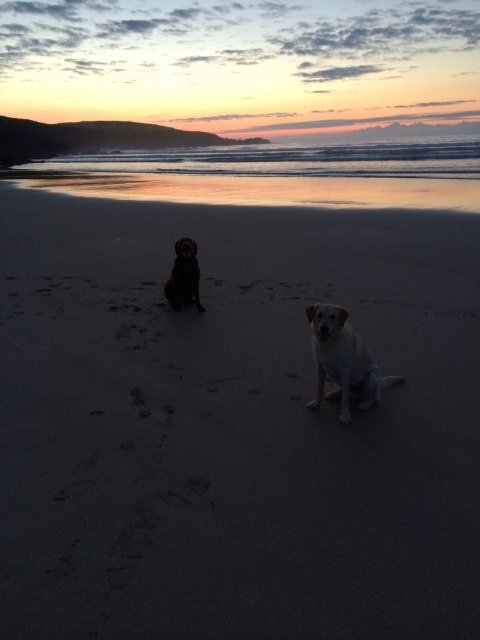
Question: Where is smooth sand at center located in relation to golden fur dog at center in the image?

Choices:
 (A) left
 (B) right

Answer: (A)

Question: Which of the following is the closest to the observer?

Choices:
 (A) (50, 228)
 (B) (193, 301)

Answer: (B)

Question: Which point appears closest to the camera in this image?

Choices:
 (A) (171, 300)
 (B) (450, 488)

Answer: (B)

Question: From the image, what is the correct spatial relationship of smooth sand at center in relation to golden fur dog at center?

Choices:
 (A) right
 (B) left

Answer: (B)

Question: Among these objects, which one is farthest from the camera?

Choices:
 (A) golden fur dog at center
 (B) shiny black dog at center

Answer: (B)

Question: Does smooth sand at center have a smaller size compared to golden fur dog at center?

Choices:
 (A) no
 (B) yes

Answer: (A)